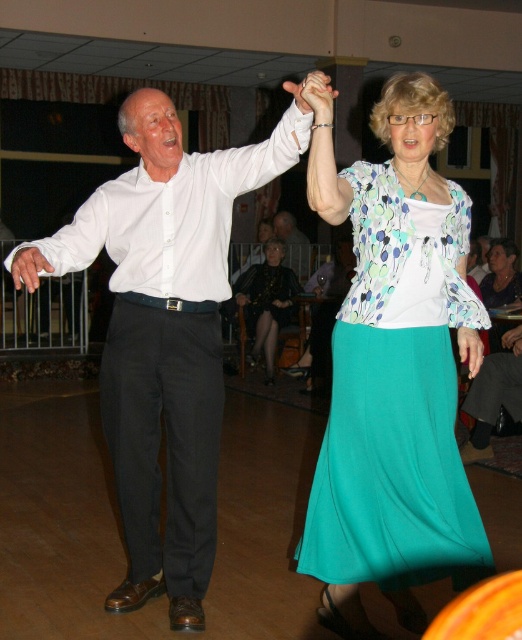
You are observing a dance performance from the audience. You notice a white smooth shirt at left and a matte white hand at center. Which object is positioned lower in the scene?

The white smooth shirt at left is positioned below the matte white hand at center, so the white smooth shirt at left is lower in the scene.

You are observing a dance scene from the audience. You notice two shirts in the image, the white smooth shirt at left and the matte black shirt at upper center. Which shirt is taller?

The white smooth shirt at left is taller than the matte black shirt at upper center.

You are a photographer setting up for a dance event in the venue. You need to ensure that the white smooth shirt at left and the matte white hand at center are both visible in your shot. Given their sizes, which object should you prioritize framing closer to the camera to maintain clarity?

The white smooth shirt at left is wider than the matte white hand at center, so you should prioritize framing the white smooth shirt at left closer to the camera to ensure both objects are clearly visible.